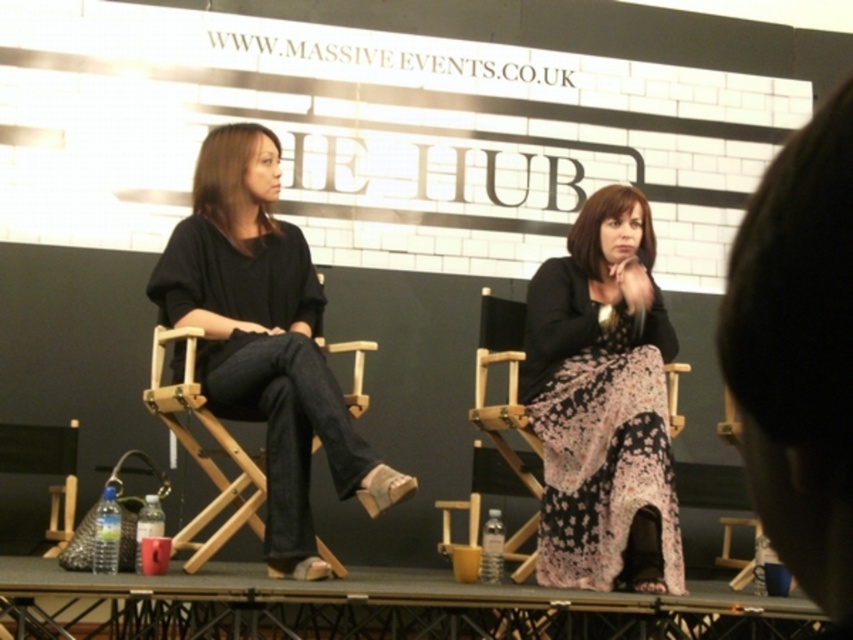
Which is more to the left, floral-patterned dress at center or wooden director's chair at lower left?

Positioned to the left is wooden director's chair at lower left.

Does floral-patterned dress at center have a greater width compared to wooden director's chair at lower left?

Indeed, floral-patterned dress at center has a greater width compared to wooden director's chair at lower left.

Consider the image. Who is more forward, (606, 349) or (62, 433)?

Point (606, 349) is more forward.

At what (x,y) coordinates should I click in order to perform the action: click on floral-patterned dress at center. Please return your answer as a coordinate pair (x, y). The height and width of the screenshot is (640, 853). Looking at the image, I should click on (602, 404).

Between point (189, 561) and point (22, 461), which one is positioned behind?

The point (22, 461) is behind.

Where is `wooden director's chair at center`? wooden director's chair at center is located at coordinates (206, 449).

Which of these two, floral-patterned dress at center or wooden director's chair at center, stands taller?

Standing taller between the two is floral-patterned dress at center.

Can you confirm if floral-patterned dress at center is shorter than wooden director's chair at center?

No.

Is point (666, 545) more distant than point (149, 396)?

That is False.

Where is `floral-patterned dress at center`? floral-patterned dress at center is located at coordinates (602, 404).